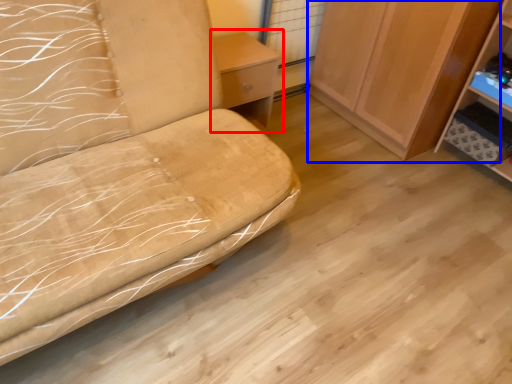
Question: Which object appears farthest to the camera in this image, table (highlighted by a red box) or cabinetry (highlighted by a blue box)?

Choices:
 (A) table
 (B) cabinetry

Answer: (A)